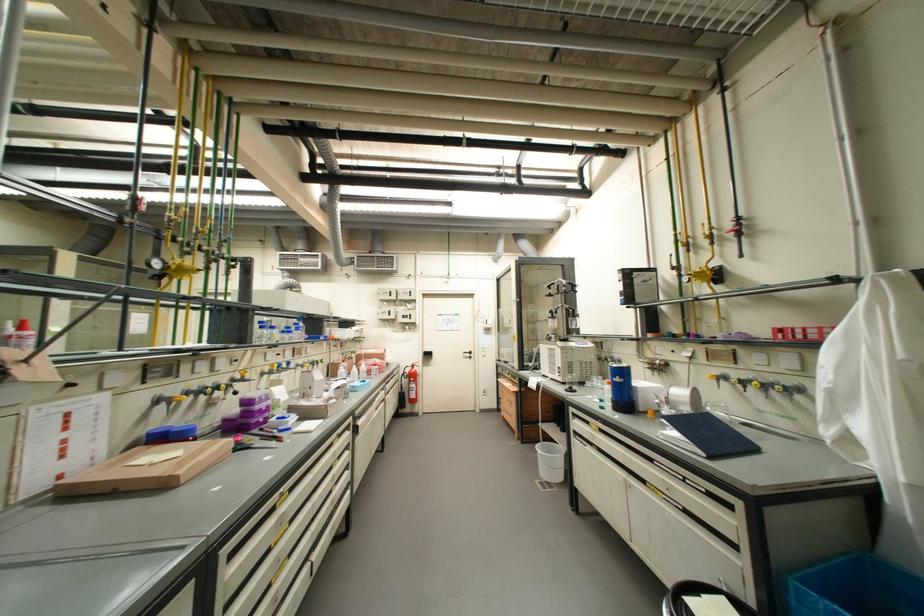
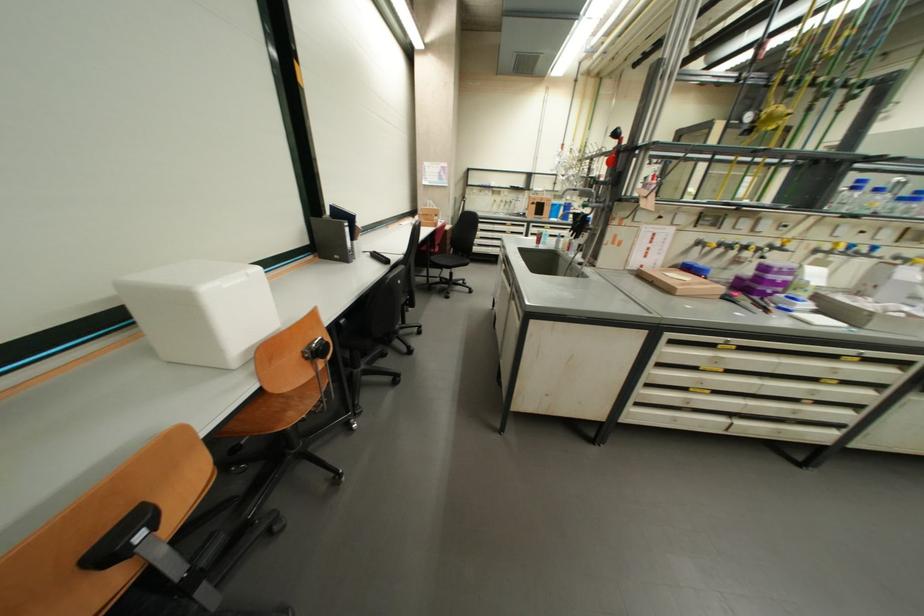
The first image is from the beginning of the video and the second image is from the end. How did the camera likely rotate when shooting the video?

The camera's rotation is toward left-down.